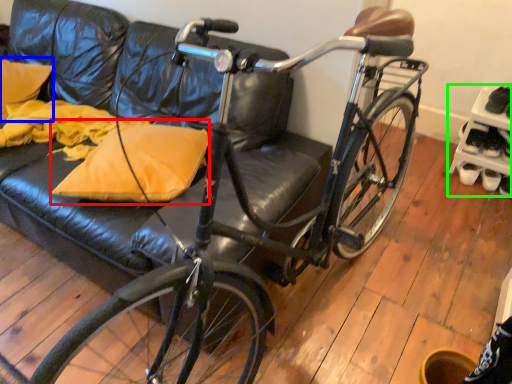
Question: Which is nearer to the throw pillow (highlighted by a red box)? pillow (highlighted by a blue box) or shelf (highlighted by a green box).

Choices:
 (A) pillow
 (B) shelf

Answer: (A)